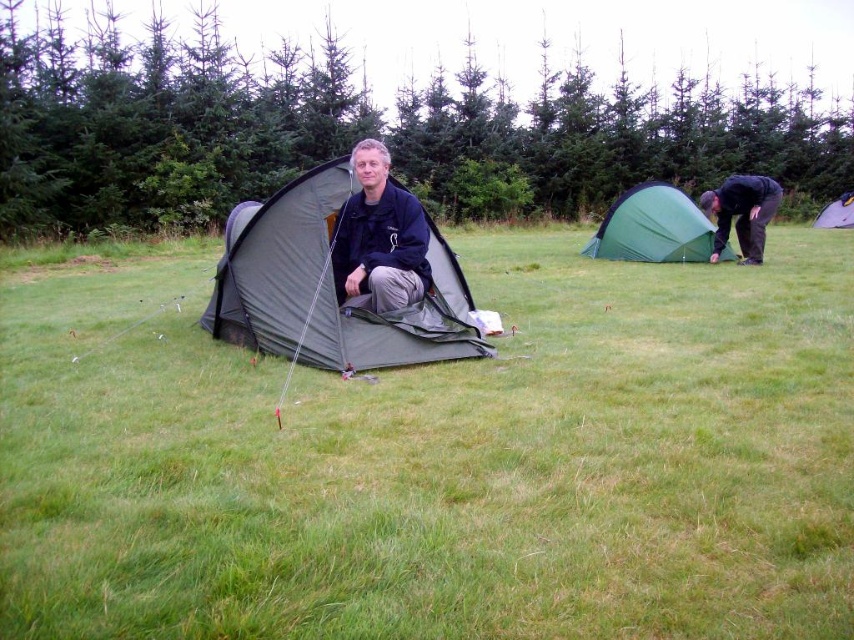
You are planning to set up a picnic blanket between the dark gray fabric tent at right and the matte gray tent at upper right. The picnic blanket requires a space of 4 meters. Can you fit it between them?

The dark gray fabric tent at right is 5.54 meters away from the matte gray tent at upper right, so yes, the picnic blanket requiring 4 meters can fit between them since the distance is sufficient.

You are a hiker who wants to set up a tent in this camping area. You have a tent that requires a minimum of 5 meters of space between it and any other tents. Is the distance between the dark gray fabric tent at right and the other tent in the scene sufficient for your requirement?

The distance between the dark gray fabric tent at right and the other tent is 6.32 meters, which is more than the required 5 meters. Therefore, the space is sufficient for your tent setup.

You are planning to set up a small camping mat for a picnic. You have two options in the image to place it on. The green grass at center and the matte gray tent at upper right. Which surface would you choose to place the mat so that it fits properly?

The green grass at center has a smaller size compared to matte gray tent at upper right, so the mat would fit better on the matte gray tent at upper right since it has more space.